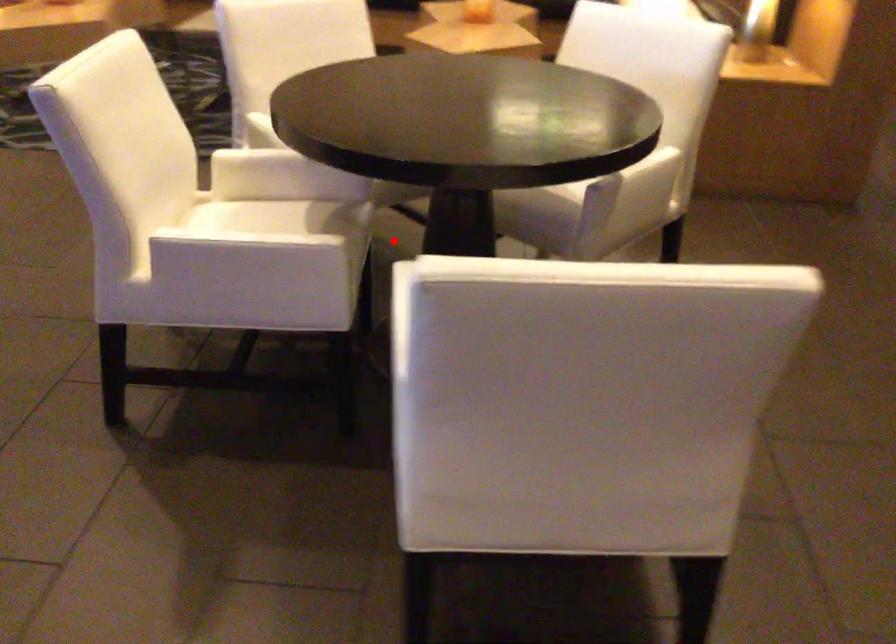
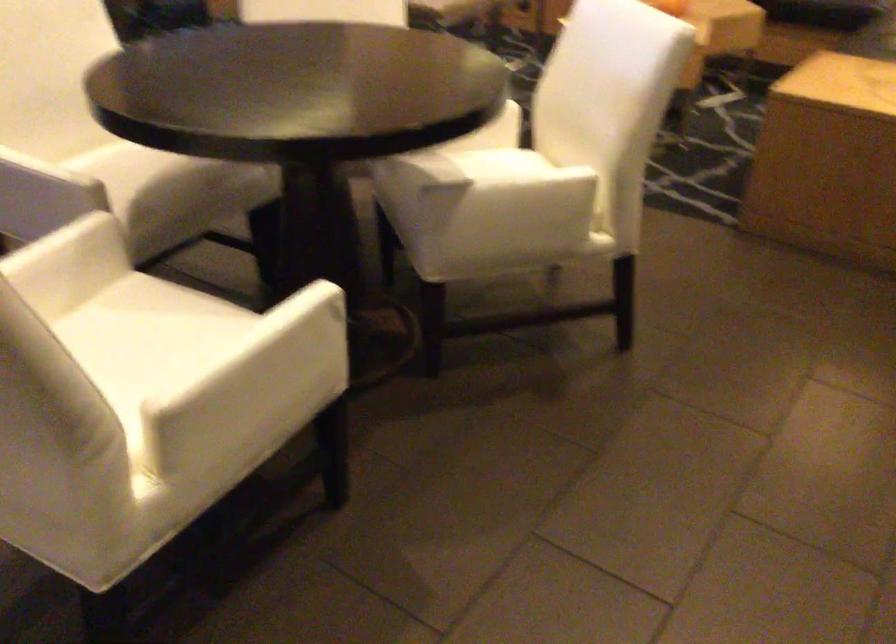
Question: I am providing you with two images of the same scene from different viewpoints. A red point is marked on the first image. Is the red point's position out of view in image 2?

Choices:
 (A) Yes
 (B) No

Answer: (A)